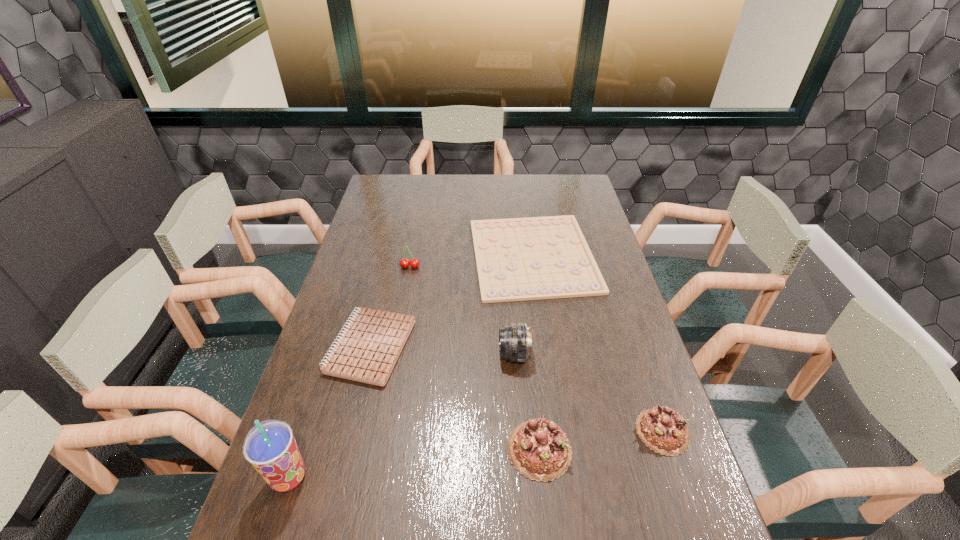
Locate an element on the screen. vacant area that lies between the gameboard and the cherry is located at coordinates pyautogui.click(x=471, y=261).

Where is `vacant area between the fifth shortest object and the telephoto lens`? vacant area between the fifth shortest object and the telephoto lens is located at coordinates (462, 310).

Where is `empty location between the right chocolate cake and the third tallest object`? The width and height of the screenshot is (960, 540). empty location between the right chocolate cake and the third tallest object is located at coordinates (537, 349).

What are the coordinates of `vacant area that lies between the left chocolate cake and the sixth shortest object` in the screenshot? It's located at click(x=527, y=402).

This screenshot has width=960, height=540. I want to click on free point between the second shortest object and the smoothie, so click(329, 412).

This screenshot has height=540, width=960. I want to click on vacant space that's between the third shortest object and the smoothie, so click(x=475, y=455).

This screenshot has width=960, height=540. I want to click on unoccupied position between the second shortest object and the telephoto lens, so click(442, 350).

Where is `blank region between the tallest object and the shortest object`? This screenshot has width=960, height=540. blank region between the tallest object and the shortest object is located at coordinates (411, 367).

Locate which object ranks second in proximity to the notebook. Please provide its 2D coordinates. Your answer should be formatted as a tuple, i.e. [(x, y)], where the tuple contains the x and y coordinates of a point satisfying the conditions above.

[(270, 447)]

You are a GUI agent. You are given a task and a screenshot of the screen. Output one action in this format:
    pyautogui.click(x=<x>, y=<y>)
    Task: Click on the second closest object to the gameboard
    The width and height of the screenshot is (960, 540).
    Given the screenshot: What is the action you would take?
    pyautogui.click(x=369, y=347)